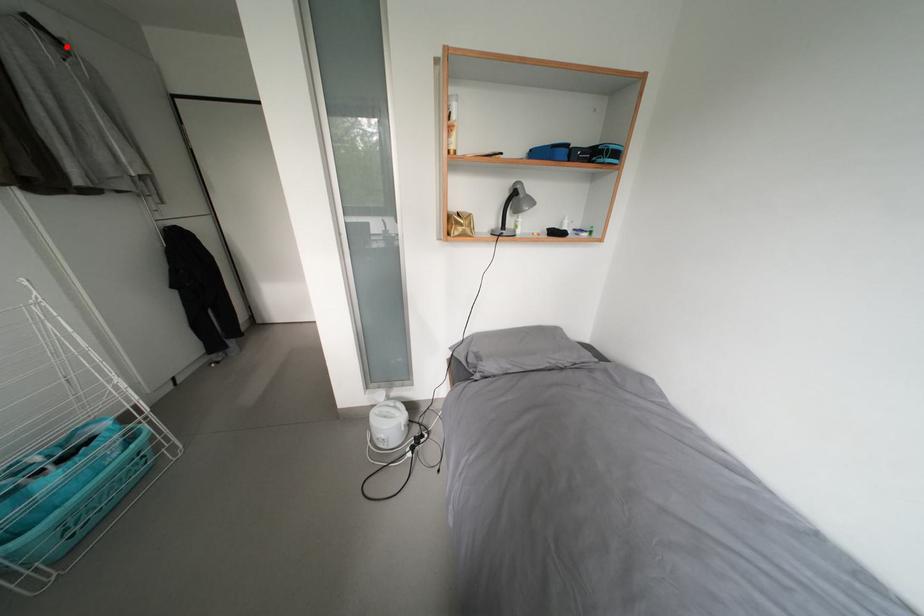
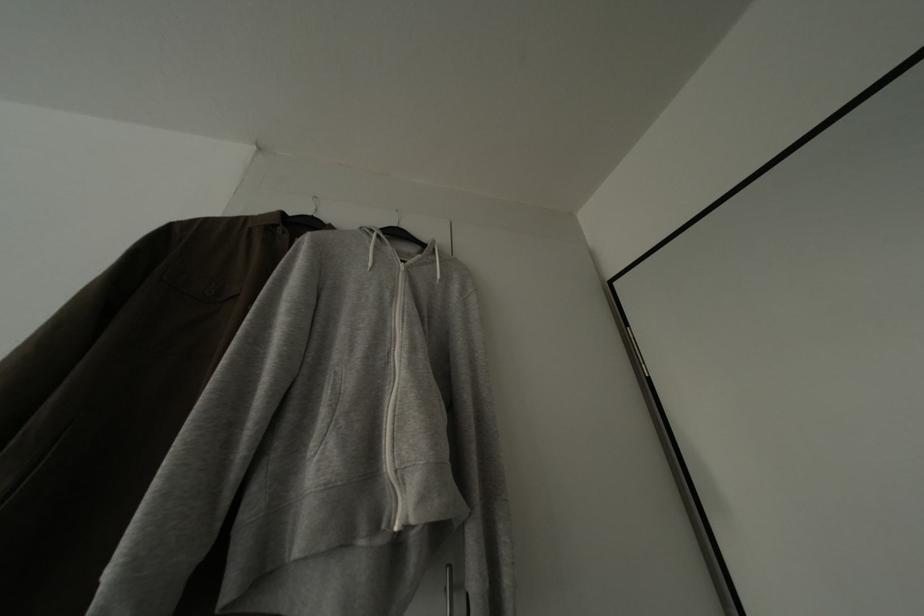
Question: A red point is marked in image1. In image2, is the corresponding 3D point closer to the camera or farther? Reply with the corresponding letter.

Choices:
 (A) The corresponding 3D point is closer.
 (B) The corresponding 3D point is farther.

Answer: (A)